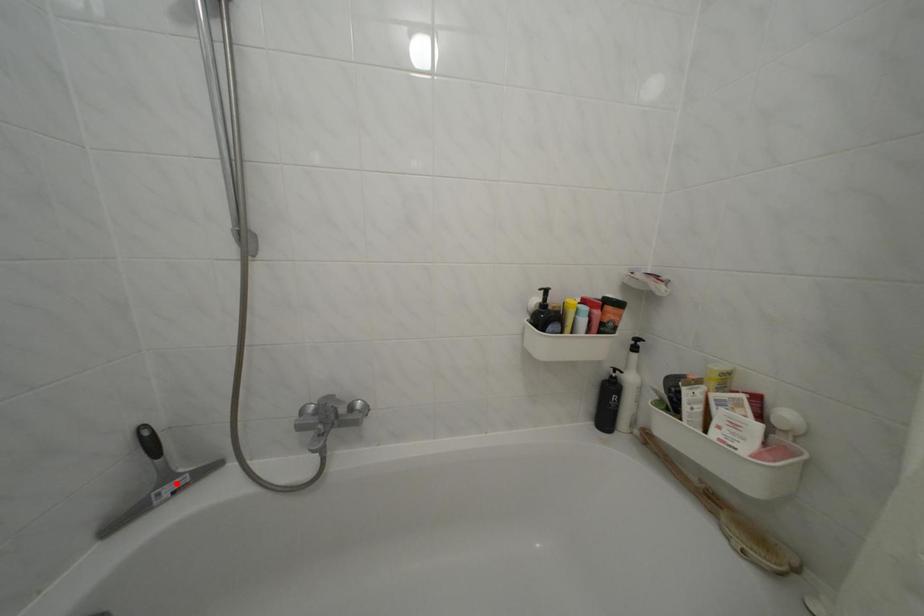
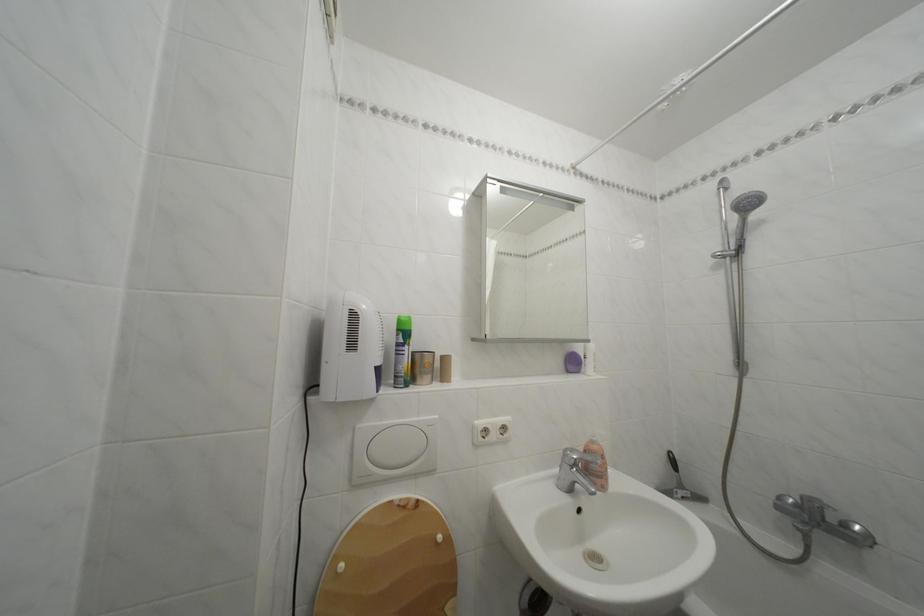
The point at the highlighted location is marked in the first image. Where is the corresponding point in the second image?

(689, 492)